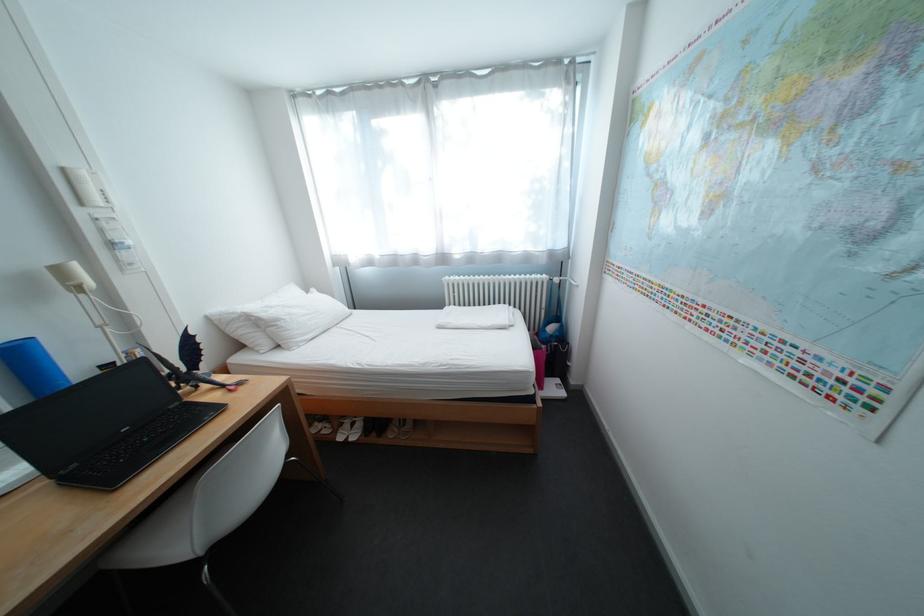
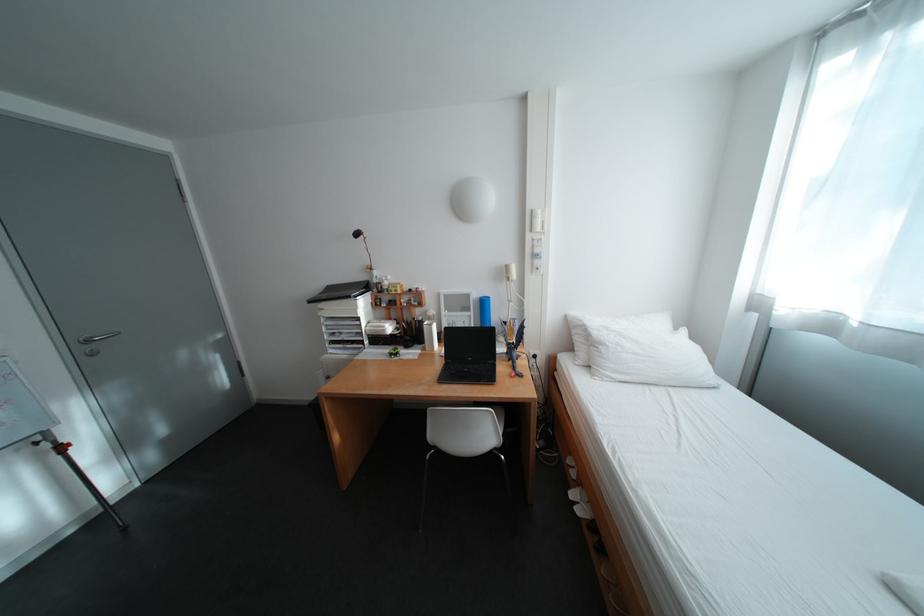
In the second image, find the point that corresponds to pixel 92 214 in the first image.

(541, 237)